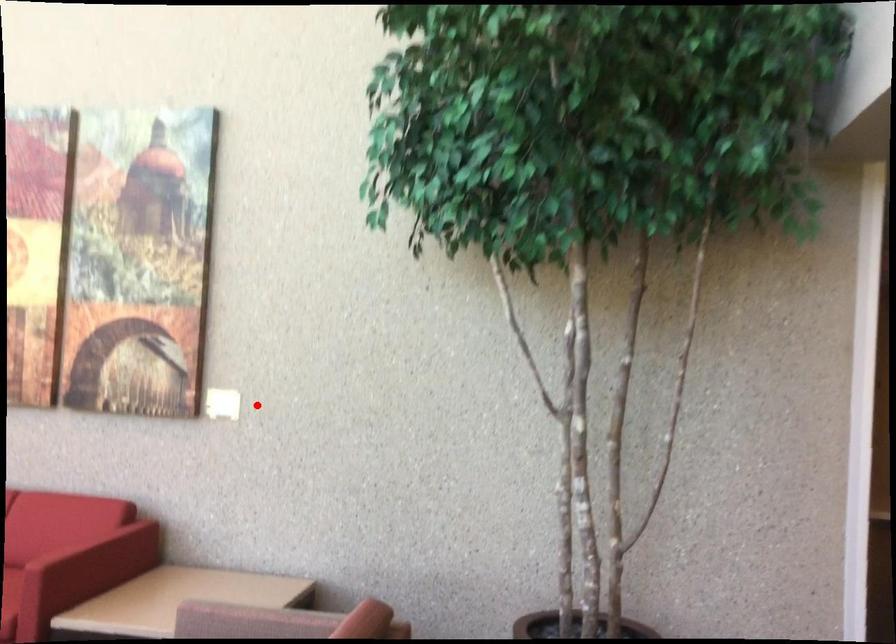
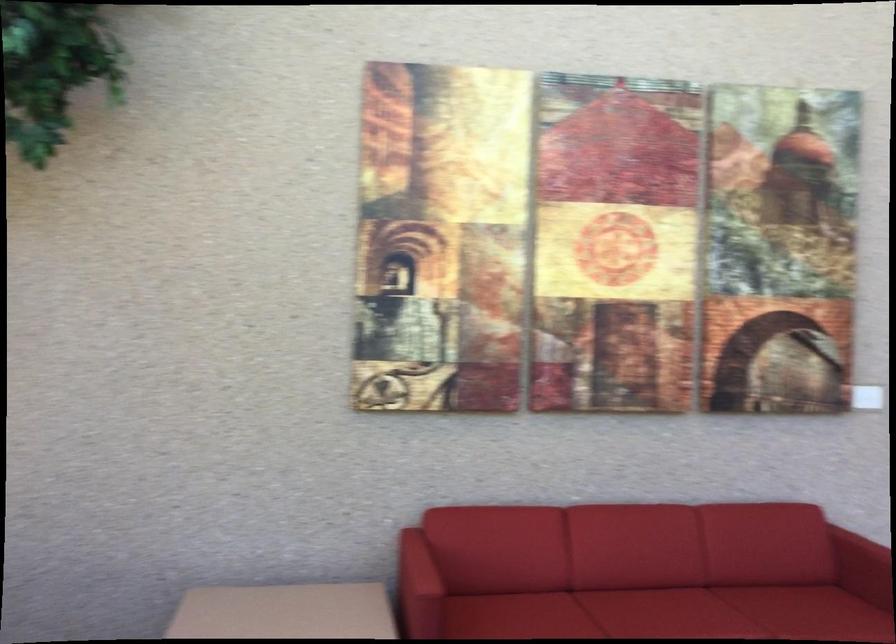
Locate, in the second image, the point that corresponds to the highlighted location in the first image.

(867, 397)